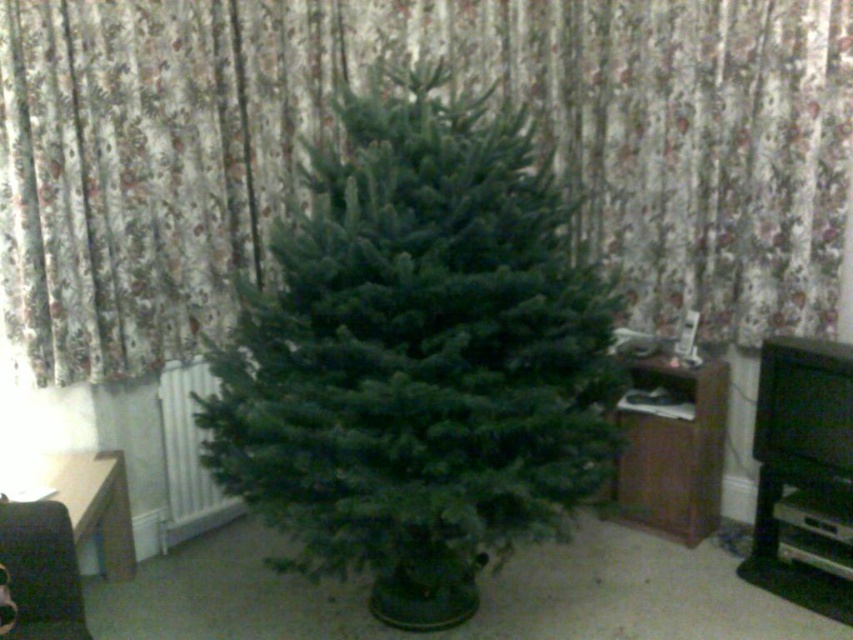
You are standing in the living room where the Christmas tree is placed. There are two points marked in the scene. The first point is at coordinates point (503, 80) and the second is at point (281, 445). From your perspective, which point is closer to you?

Point (281, 445) is closer to you because it is in front of point (503, 80) according to the spatial description.

You are standing in the living room and want to take a photo of the small, undecorated Christmas tree. The camera you are holding is 2.05 meters away from the floral fabric curtain at center. Can you fit the entire tree into the camera frame without moving the camera or the tree?

The camera is 2.05 meters away from the floral fabric curtain at center. Since the tree is placed in front of the curtain, the distance between the camera and the tree would be less than 2.05 meters. Therefore, the entire tree can likely be captured in the camera frame without needing to adjust their positions.